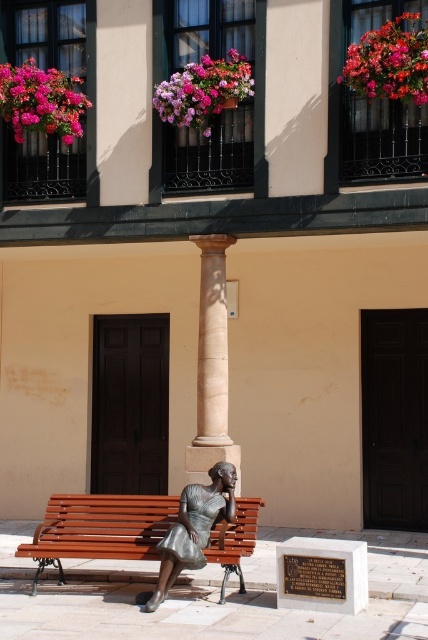
You are a visitor standing in front of the building and see the beige marble column at center and the bronze statue at center. Which object is located behind the other?

The beige marble column at center is positioned over bronze statue at center, meaning the column is above the statue. Since the column is over the statue, the bronze statue at center is behind the beige marble column at center from your viewpoint.

You are a maintenance worker who needs to place a 60 cm wide maintenance cart between the wooden bench at center and the bronze statue at center. Can the cart fit in the space between them?

The wooden bench at center and bronze statue at center are 62.14 centimeters apart. Since the cart is 60 cm wide, it can fit in the space between them as the distance is slightly larger than the cart.